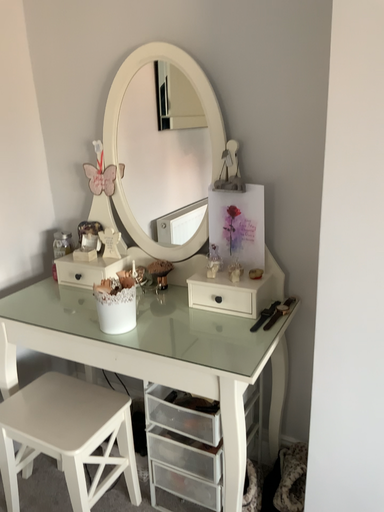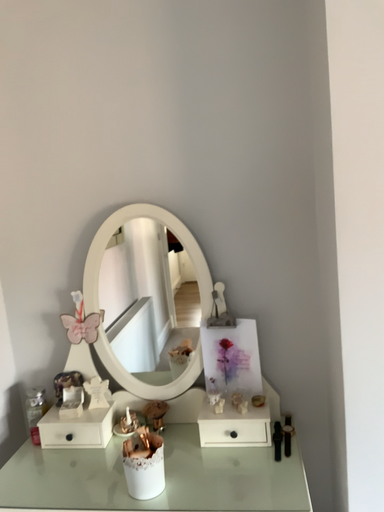
Question: Which way did the camera rotate in the video?

Choices:
 (A) rotated left
 (B) rotated right

Answer: (B)